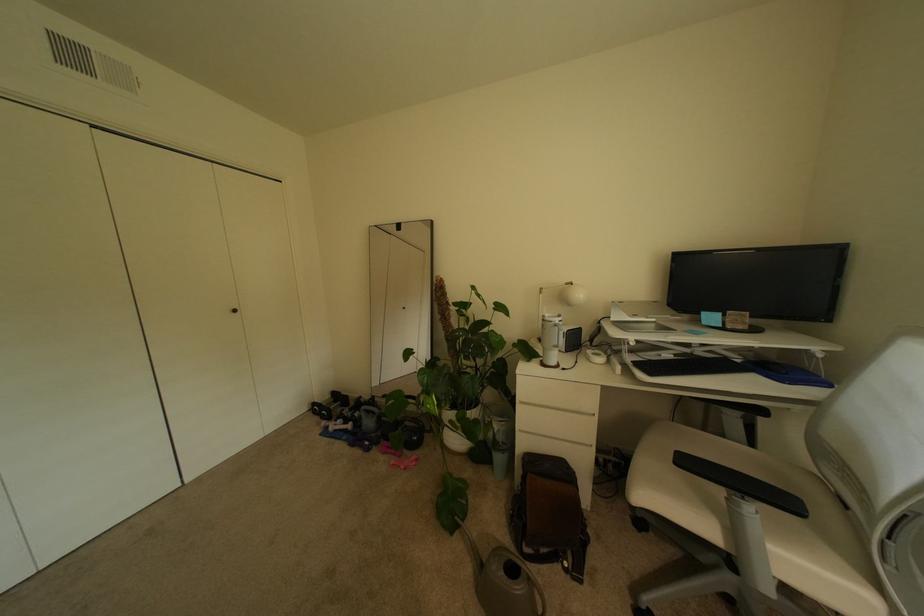
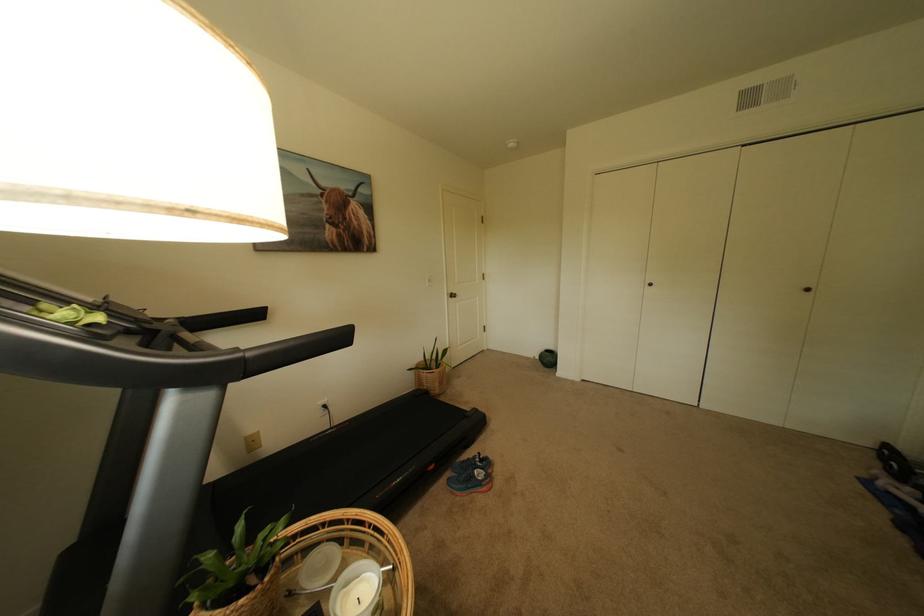
How did the camera likely rotate?

The camera rotated toward left-down.